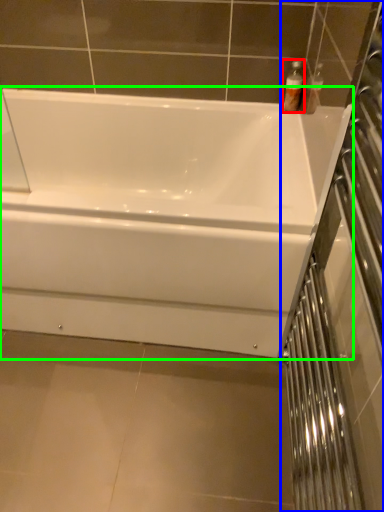
Question: Which object is the farthest from toiletry (highlighted by a red box)? Choose among these: screen door (highlighted by a blue box) or bathtub (highlighted by a green box).

Choices:
 (A) screen door
 (B) bathtub

Answer: (A)